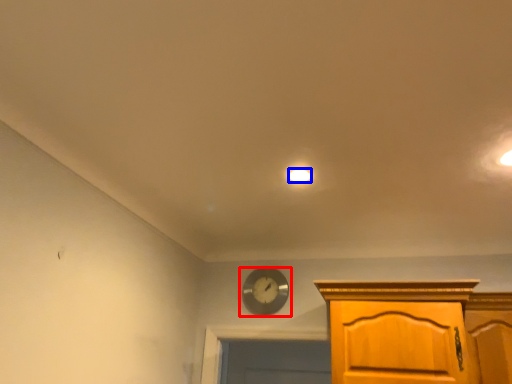
Question: Which object is closer to the camera taking this photo, wall clock (highlighted by a red box) or lighting (highlighted by a blue box)?

Choices:
 (A) wall clock
 (B) lighting

Answer: (B)